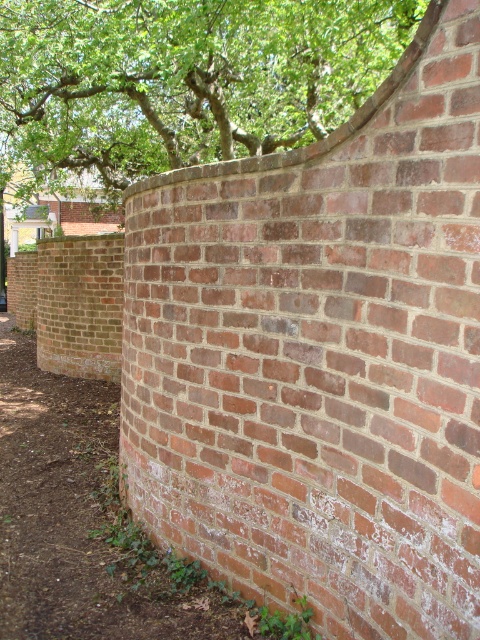
Between point (286, 83) and point (92, 630), which one is positioned in front?

Point (92, 630) is more forward.

You are a GUI agent. You are given a task and a screenshot of the screen. Output one action in this format:
    pyautogui.click(x=<x>, y=<y>)
    Task: Click on the green leafy tree at upper center
    
    Given the screenshot: What is the action you would take?
    pyautogui.click(x=182, y=80)

I want to click on green leafy tree at upper center, so click(182, 80).